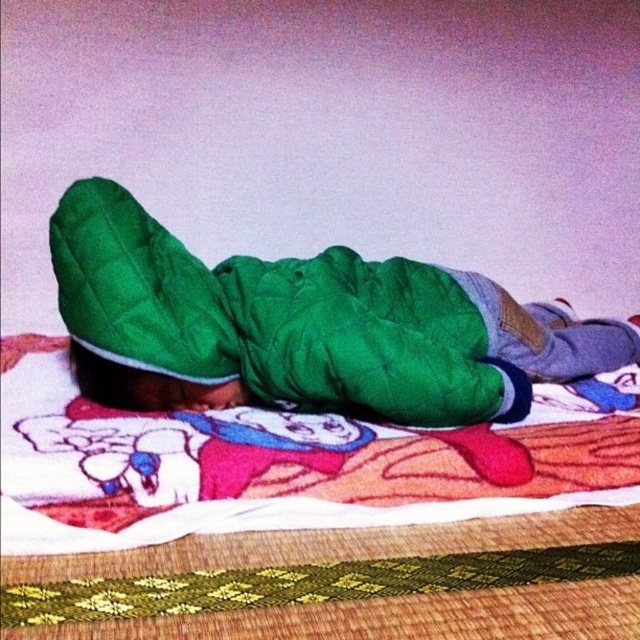
I want to click on green quilted jacket at center, so click(301, 326).

The image size is (640, 640). What do you see at coordinates (301, 326) in the screenshot? I see `green quilted jacket at center` at bounding box center [301, 326].

I want to click on green quilted jacket at center, so click(x=301, y=326).